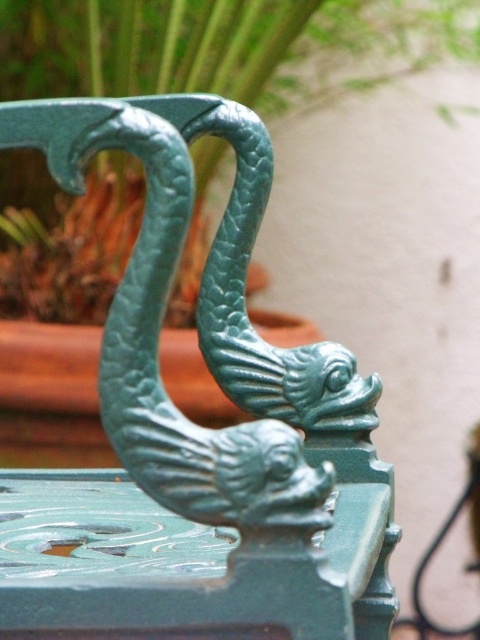
You are an interior designer assessing the spatial arrangement of the armrest. You notice the green cast iron dragon at center and the green textured plant at upper center. Which object appears larger in the scene?

The green textured plant at upper center appears larger than the green cast iron dragon at center.

Based on the photo, you are an interior designer assessing a room with a green cast iron dragon at center and a green textured plant at upper center. Which object is taller when viewed from the front?

The green textured plant at upper center is taller than the green cast iron dragon at center.

You are an interior designer arranging a living room. You have a green cast iron dragon at center and a green textured plant at upper center. According to the scene, which object is positioned to the right of the other?

The green cast iron dragon at center is to the right of the green textured plant at upper center.